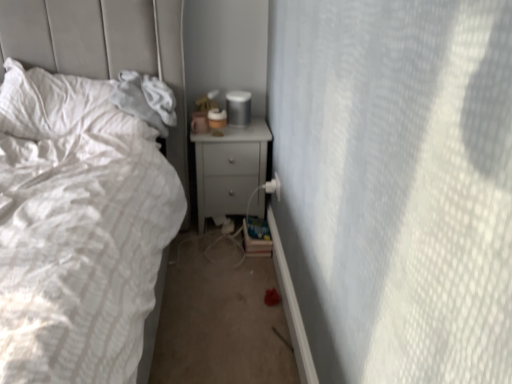
Question: Is white textured pillow at left positioned beyond the bounds of matte plastic cup at upper right?

Choices:
 (A) yes
 (B) no

Answer: (A)

Question: From a real-world perspective, is white textured pillow at left physically above matte plastic cup at upper right?

Choices:
 (A) no
 (B) yes

Answer: (B)

Question: Is white textured pillow at left far away from matte plastic cup at upper right?

Choices:
 (A) yes
 (B) no

Answer: (B)

Question: Is white textured pillow at left taller than matte plastic cup at upper right?

Choices:
 (A) yes
 (B) no

Answer: (A)

Question: From the image's perspective, is white textured pillow at left beneath matte plastic cup at upper right?

Choices:
 (A) no
 (B) yes

Answer: (B)

Question: Do you think white textured pillow at left is within matte plastic cup at upper right, or outside of it?

Choices:
 (A) inside
 (B) outside

Answer: (B)

Question: Visually, is white textured pillow at left positioned to the left or to the right of matte plastic cup at upper right?

Choices:
 (A) right
 (B) left

Answer: (B)

Question: Considering the positions of white textured pillow at left and matte plastic cup at upper right in the image, is white textured pillow at left bigger or smaller than matte plastic cup at upper right?

Choices:
 (A) big
 (B) small

Answer: (A)

Question: Relative to matte plastic cup at upper right, is white textured pillow at left in front or behind?

Choices:
 (A) behind
 (B) front

Answer: (B)

Question: Is matte plastic cup at upper right spatially inside white textured pillow at left, or outside of it?

Choices:
 (A) outside
 (B) inside

Answer: (A)

Question: In terms of height, does matte plastic cup at upper right look taller or shorter compared to white textured pillow at left?

Choices:
 (A) short
 (B) tall

Answer: (A)

Question: From the image's perspective, is matte plastic cup at upper right above or below white textured pillow at left?

Choices:
 (A) below
 (B) above

Answer: (B)

Question: Considering the positions of point (234, 119) and point (95, 109), is point (234, 119) closer or farther from the camera than point (95, 109)?

Choices:
 (A) farther
 (B) closer

Answer: (A)

Question: Considering the positions of matte gray nightstand at center and white textured pillow at left in the image, is matte gray nightstand at center wider or thinner than white textured pillow at left?

Choices:
 (A) thin
 (B) wide

Answer: (A)

Question: From the image's perspective, is matte gray nightstand at center above or below white textured pillow at left?

Choices:
 (A) below
 (B) above

Answer: (A)